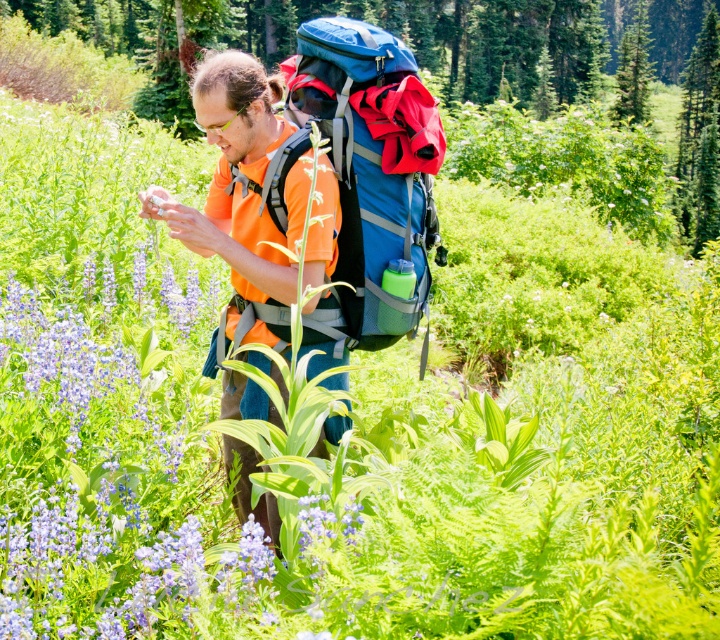
Does purple matte flower at center-left appear on the left side of blue fabric backpack at center?

Correct, you'll find purple matte flower at center-left to the left of blue fabric backpack at center.

This screenshot has height=640, width=720. Find the location of `purple matte flower at center-left`. purple matte flower at center-left is located at coordinates (117, 464).